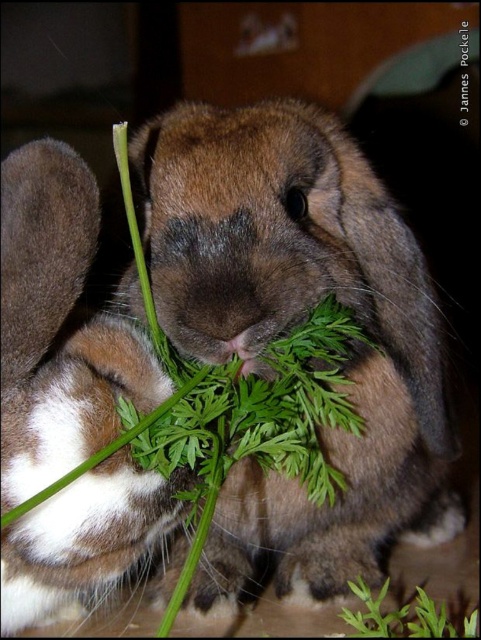
Question: Can you confirm if brown fur rabbit at left is smaller than green leafy plant at lower right?

Choices:
 (A) yes
 (B) no

Answer: (B)

Question: Can you confirm if brown fur rabbit at center is smaller than brown fur rabbit at left?

Choices:
 (A) yes
 (B) no

Answer: (B)

Question: Which point is closer to the camera?

Choices:
 (A) green leafy plant at lower right
 (B) brown fur rabbit at left

Answer: (B)

Question: Is brown fur rabbit at center thinner than brown fur rabbit at left?

Choices:
 (A) no
 (B) yes

Answer: (A)

Question: Which point appears closest to the camera in this image?

Choices:
 (A) (235, 582)
 (B) (104, 429)

Answer: (B)

Question: Which is nearer to the brown fur rabbit at left?

Choices:
 (A) brown fur rabbit at center
 (B) green leafy plant at lower right

Answer: (A)